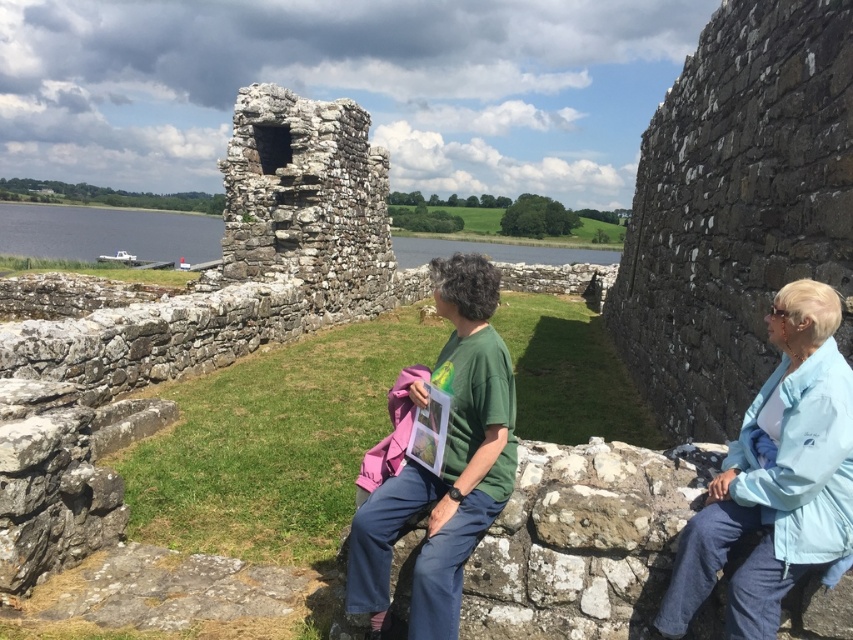
Question: Is green matte shirt at center further to camera compared to clear water at lower left?

Choices:
 (A) yes
 (B) no

Answer: (B)

Question: Does light blue fabric at right have a greater width compared to green matte shirt at center?

Choices:
 (A) no
 (B) yes

Answer: (B)

Question: Which of the following is the farthest from the observer?

Choices:
 (A) (834, 442)
 (B) (474, 308)
 (C) (837, 408)
 (D) (73, 253)

Answer: (D)

Question: Which point appears closest to the camera in this image?

Choices:
 (A) coord(97,227)
 (B) coord(491,419)
 (C) coord(480,432)

Answer: (B)

Question: Which point is closer to the camera?

Choices:
 (A) light blue fabric at right
 (B) green cotton shirt at center

Answer: (A)

Question: Is green matte shirt at center bigger than clear water at lower left?

Choices:
 (A) no
 (B) yes

Answer: (A)